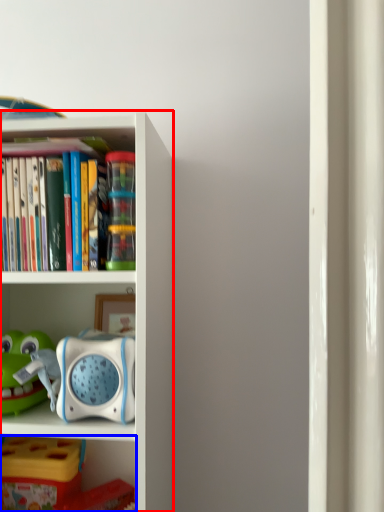
Question: Among these objects, which one is nearest to the camera, bookcase (highlighted by a red box) or shelf (highlighted by a blue box)?

Choices:
 (A) bookcase
 (B) shelf

Answer: (A)